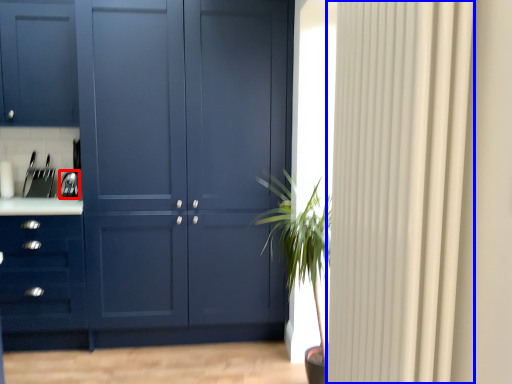
Question: Among these objects, which one is farthest to the camera, appliance (highlighted by a red box) or curtain (highlighted by a blue box)?

Choices:
 (A) appliance
 (B) curtain

Answer: (A)